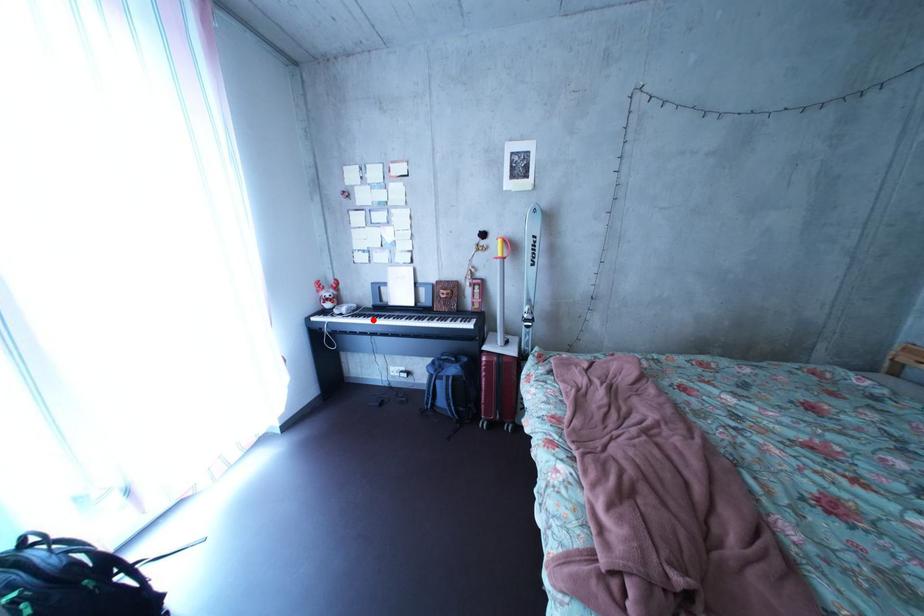
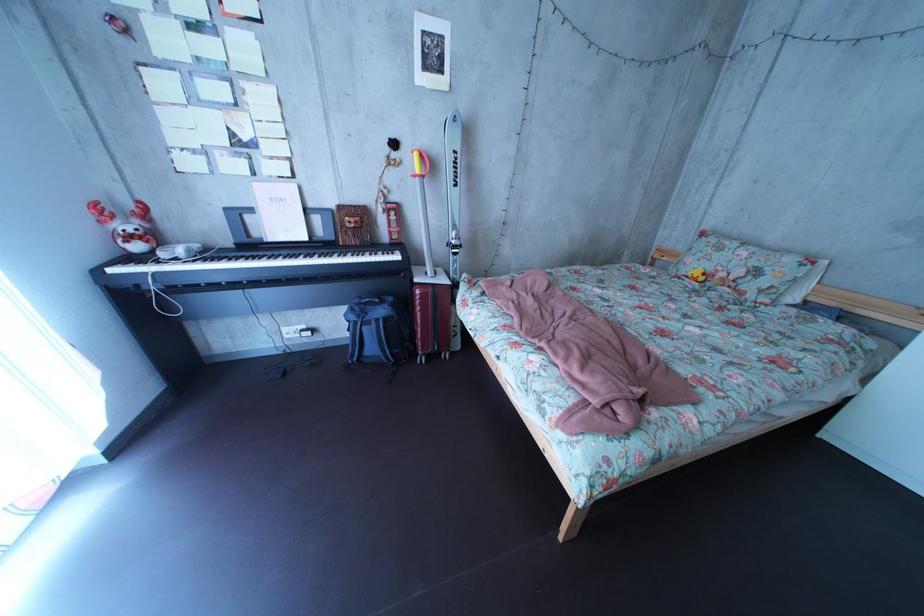
Question: I am providing you with two images of the same scene from different viewpoints. Image1 has a red point marked. In image2, the corresponding 3D location appears at what relative position? Reply with the corresponding letter.

Choices:
 (A) Closer
 (B) Farther

Answer: (A)